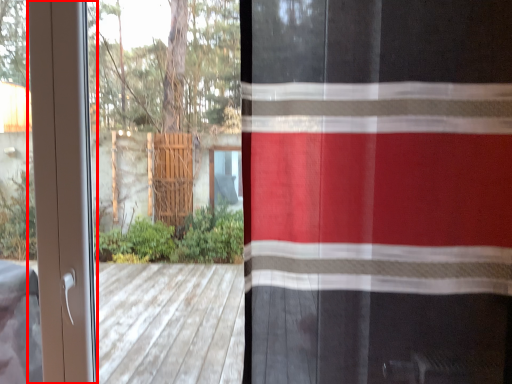
Question: From the image's perspective, considering the relative positions of screen door (annotated by the red box) and curtain in the image provided, where is screen door (annotated by the red box) located with respect to the staircase?

Choices:
 (A) below
 (B) above

Answer: (A)